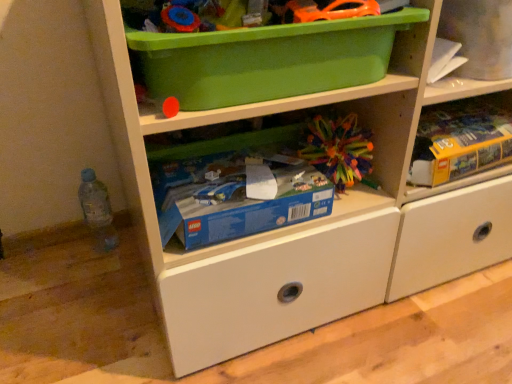
Question: Could you tell me if yellow cardboard box at upper right is turned towards multicolored plastic ball at center, the 2th toy when ordered from front to back?

Choices:
 (A) no
 (B) yes

Answer: (A)

Question: Is yellow cardboard box at upper right looking in the opposite direction of multicolored plastic ball at center, the 2th toy when ordered from front to back?

Choices:
 (A) no
 (B) yes

Answer: (A)

Question: Considering the relative positions of yellow cardboard box at upper right and multicolored plastic ball at center, marked as the 2th toy in a top-to-bottom arrangement, in the image provided, is yellow cardboard box at upper right to the right of multicolored plastic ball at center, marked as the 2th toy in a top-to-bottom arrangement, from the viewer's perspective?

Choices:
 (A) no
 (B) yes

Answer: (B)

Question: Is yellow cardboard box at upper right positioned beyond the bounds of multicolored plastic ball at center, which is the first toy in back-to-front order?

Choices:
 (A) no
 (B) yes

Answer: (B)

Question: From a real-world perspective, does yellow cardboard box at upper right sit lower than multicolored plastic ball at center, which is the first toy in back-to-front order?

Choices:
 (A) no
 (B) yes

Answer: (B)

Question: Would you say yellow cardboard box at upper right is to the left or to the right of green plastic storage box at upper center, arranged as the 2th storage box when ordered from the bottom, in the picture?

Choices:
 (A) right
 (B) left

Answer: (A)

Question: Is yellow cardboard box at upper right taller or shorter than green plastic storage box at upper center, marked as the 1th storage box in a top-to-bottom arrangement?

Choices:
 (A) short
 (B) tall

Answer: (A)

Question: From the image's perspective, is yellow cardboard box at upper right above or below green plastic storage box at upper center, marked as the 1th storage box in a top-to-bottom arrangement?

Choices:
 (A) below
 (B) above

Answer: (A)

Question: In terms of width, does yellow cardboard box at upper right look wider or thinner when compared to green plastic storage box at upper center, marked as the 1th storage box in a top-to-bottom arrangement?

Choices:
 (A) thin
 (B) wide

Answer: (A)

Question: Does point (81, 201) appear closer or farther from the camera than point (324, 132)?

Choices:
 (A) closer
 (B) farther

Answer: (B)

Question: Considering the positions of translucent plastic bottle at lower left and multicolored plastic ball at center, marked as the 2th toy in a top-to-bottom arrangement, in the image, is translucent plastic bottle at lower left wider or thinner than multicolored plastic ball at center, marked as the 2th toy in a top-to-bottom arrangement,?

Choices:
 (A) thin
 (B) wide

Answer: (A)

Question: Considering their positions, is translucent plastic bottle at lower left located in front of or behind multicolored plastic ball at center, which is the first toy in back-to-front order?

Choices:
 (A) behind
 (B) front

Answer: (A)

Question: Visually, is translucent plastic bottle at lower left positioned to the left or to the right of multicolored plastic ball at center, the 2th toy when ordered from front to back?

Choices:
 (A) left
 (B) right

Answer: (A)

Question: From a real-world perspective, is orange plastic toy car at upper center, the 2th toy from the bottom, positioned above or below multicolored plastic ball at center, marked as the 2th toy in a top-to-bottom arrangement?

Choices:
 (A) below
 (B) above

Answer: (B)

Question: Does point coord(304,3) appear closer or farther from the camera than point coord(335,180)?

Choices:
 (A) farther
 (B) closer

Answer: (B)